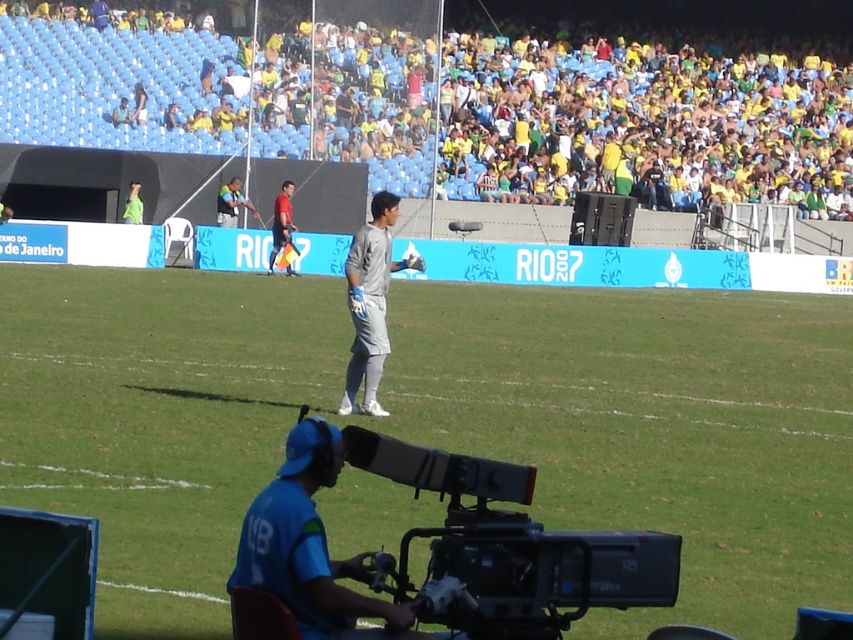
At what (x,y) coordinates should I click in order to perform the action: click on blue fabric cap at lower center. Please return your answer as a coordinate pair (x, y). Looking at the image, I should click on (310, 547).

The image size is (853, 640). Find the location of `blue fabric cap at lower center`. blue fabric cap at lower center is located at coordinates (310, 547).

Locate an element on the screen. The height and width of the screenshot is (640, 853). green jersey at upper center is located at coordinates (231, 204).

Does green jersey at upper center come behind green jersey at upper left?

Yes.

Find the location of a particular element. The width and height of the screenshot is (853, 640). green jersey at upper center is located at coordinates (231, 204).

Does yellow/yellow-green fabric seats at upper center have a lesser height compared to red shirt at center?

Incorrect, yellow/yellow-green fabric seats at upper center's height does not fall short of red shirt at center's.

The image size is (853, 640). What do you see at coordinates (408, 109) in the screenshot?
I see `yellow/yellow-green fabric seats at upper center` at bounding box center [408, 109].

Image resolution: width=853 pixels, height=640 pixels. In order to click on yellow/yellow-green fabric seats at upper center in this screenshot , I will do `click(408, 109)`.